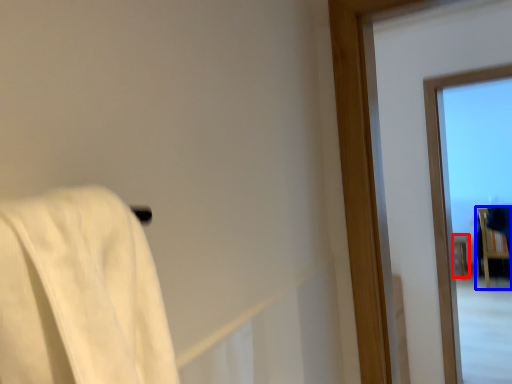
Question: Which of the following is the closest to the observer, furniture (highlighted by a red box) or furniture (highlighted by a blue box)?

Choices:
 (A) furniture
 (B) furniture

Answer: (B)